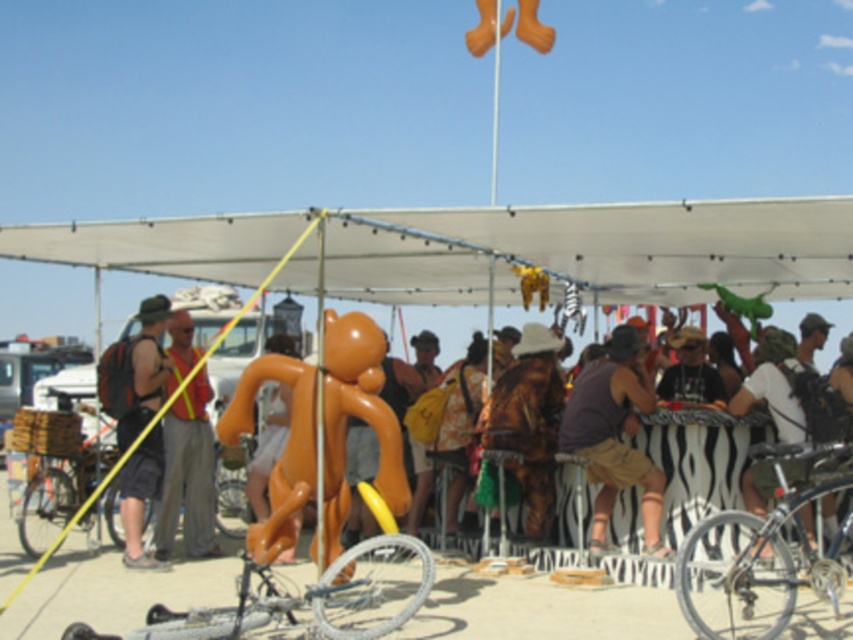
Who is more forward, (544, 401) or (694, 378)?

Point (544, 401)

Which is more to the left, gold metallic costume at center or matte brown hat at center?

From the viewer's perspective, gold metallic costume at center appears more on the left side.

Does point (543, 452) come farther from viewer compared to point (705, 387)?

That is False.

Identify the location of gold metallic costume at center. (527, 420).

Which of these two, white fabric tent at center or gold metallic costume at center, stands taller?

With more height is white fabric tent at center.

Where is `white fabric tent at center`? This screenshot has height=640, width=853. white fabric tent at center is located at coordinates (480, 250).

What do you see at coordinates (480, 250) in the screenshot? I see `white fabric tent at center` at bounding box center [480, 250].

Locate an element on the screen. The height and width of the screenshot is (640, 853). white fabric tent at center is located at coordinates (480, 250).

Is matte orange balloon at left below white matte bicycle at right?

Indeed, matte orange balloon at left is positioned under white matte bicycle at right.

Is matte orange balloon at left shorter than white matte bicycle at right?

In fact, matte orange balloon at left may be taller than white matte bicycle at right.

The width and height of the screenshot is (853, 640). Find the location of `matte orange balloon at left`. matte orange balloon at left is located at coordinates (186, 451).

You are a GUI agent. You are given a task and a screenshot of the screen. Output one action in this format:
    pyautogui.click(x=<x>, y=<y>)
    Task: Click on the matte orange balloon at left
    The height and width of the screenshot is (640, 853).
    Given the screenshot: What is the action you would take?
    [186, 451]